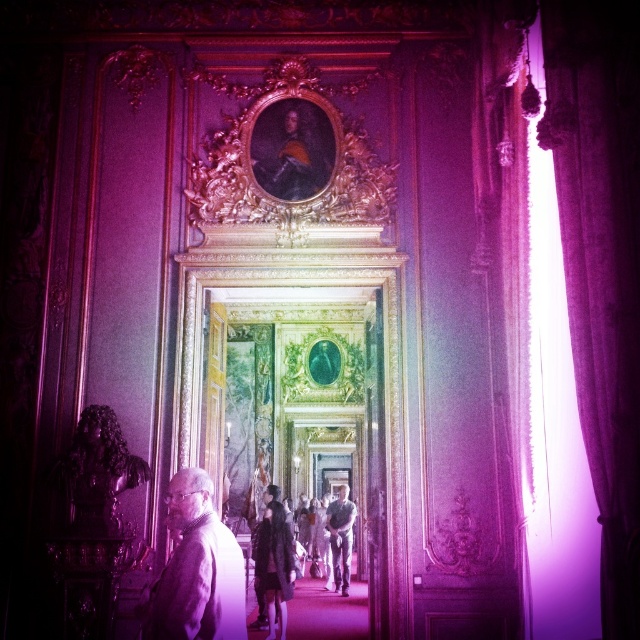
You are organizing a fashion show and need to arrange the jackets in order from left to right. Given that you have a leather jacket at center and a dark gray fabric jacket at center, which jacket should be placed first on the left side?

The leather jacket at center should be placed first on the left side since it is positioned on the left side of the dark gray fabric jacket at center.

You are standing in the opulent room described and want to place a new painting exactly where the leather jacket at center is currently located. Given the lighting conditions, will the new painting be illuminated by the strong light source from the right?

The leather jacket at center is positioned at coordinates point (273, 564). Since the light source is coming from the right side, the area where the jacket is located would be illuminated, so the new painting placed there would also be illuminated by the light source from the right.